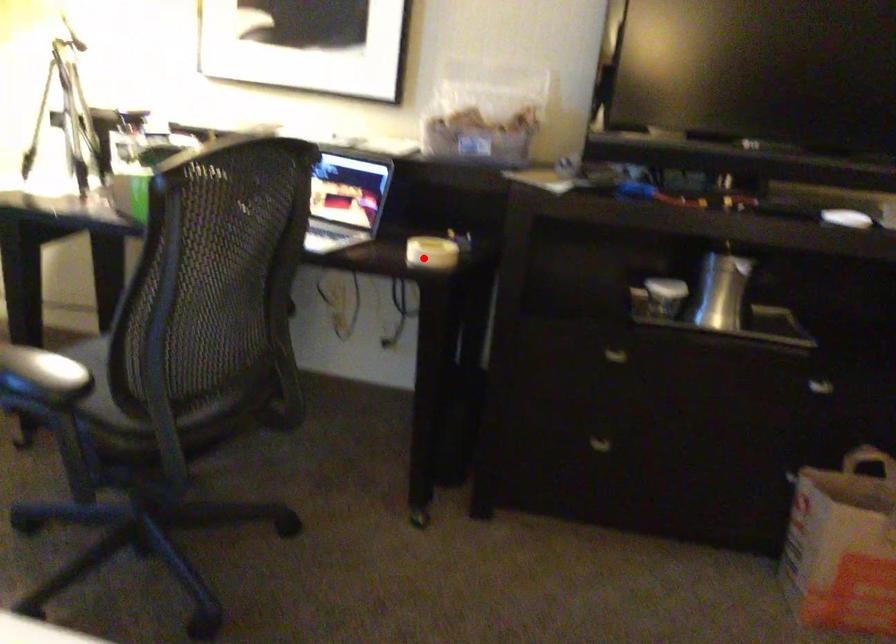
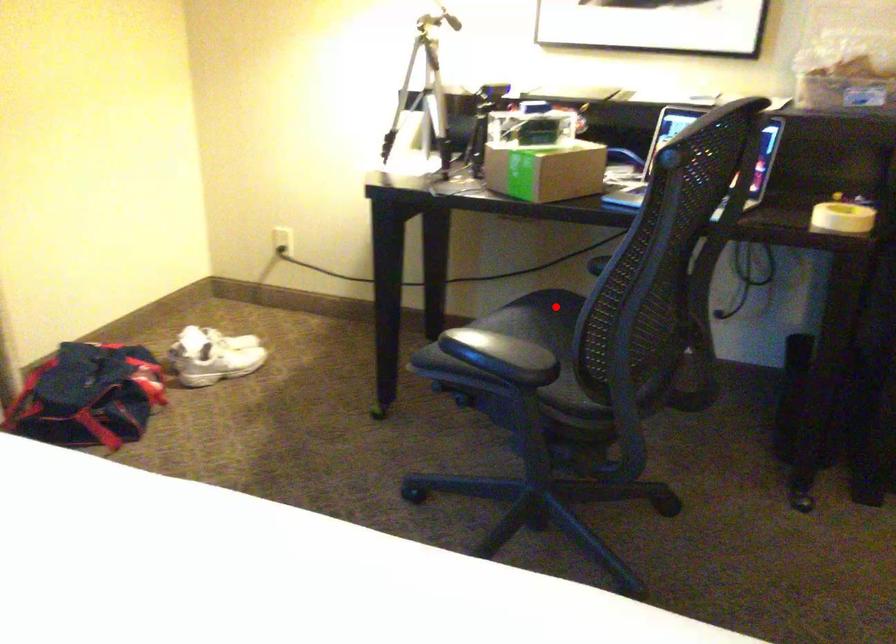
I am providing you with two images of the same scene from different viewpoints. A red point is marked on the first image and another point is marked on the second image. Do the highlighted points in image1 and image2 indicate the same real-world spot?

No